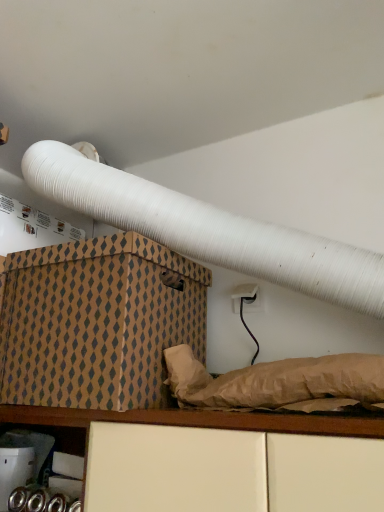
Question: Is brown cardboard box at lower left thinner than metallic silver canisters at lower left?

Choices:
 (A) no
 (B) yes

Answer: (A)

Question: Is brown cardboard box at lower left positioned far away from metallic silver canisters at lower left?

Choices:
 (A) yes
 (B) no

Answer: (B)

Question: Is brown cardboard box at lower left to the right of metallic silver canisters at lower left from the viewer's perspective?

Choices:
 (A) yes
 (B) no

Answer: (A)

Question: Does brown cardboard box at lower left come in front of metallic silver canisters at lower left?

Choices:
 (A) no
 (B) yes

Answer: (B)

Question: Is the position of brown cardboard box at lower left more distant than that of metallic silver canisters at lower left?

Choices:
 (A) yes
 (B) no

Answer: (B)

Question: Is metallic silver canisters at lower left surrounded by brown cardboard box at lower left?

Choices:
 (A) yes
 (B) no

Answer: (B)

Question: From a real-world perspective, is metallic silver canisters at lower left below brown cardboard box at lower left?

Choices:
 (A) no
 (B) yes

Answer: (B)

Question: Is metallic silver canisters at lower left to the left of brown cardboard box at lower left from the viewer's perspective?

Choices:
 (A) yes
 (B) no

Answer: (A)

Question: From the image's perspective, is metallic silver canisters at lower left beneath brown cardboard box at lower left?

Choices:
 (A) yes
 (B) no

Answer: (A)

Question: Can you confirm if metallic silver canisters at lower left is shorter than brown cardboard box at lower left?

Choices:
 (A) yes
 (B) no

Answer: (A)

Question: Can you confirm if metallic silver canisters at lower left is thinner than brown cardboard box at lower left?

Choices:
 (A) no
 (B) yes

Answer: (B)

Question: Does metallic silver canisters at lower left have a greater width compared to brown cardboard box at lower left?

Choices:
 (A) yes
 (B) no

Answer: (B)

Question: From a real-world perspective, is brown cardboard box at lower left physically located above or below metallic silver canisters at lower left?

Choices:
 (A) below
 (B) above

Answer: (B)